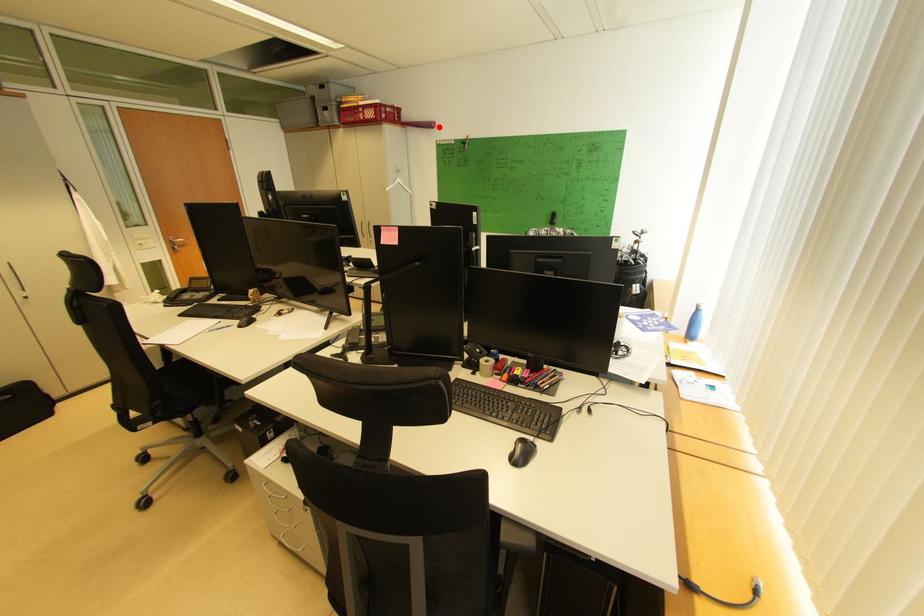
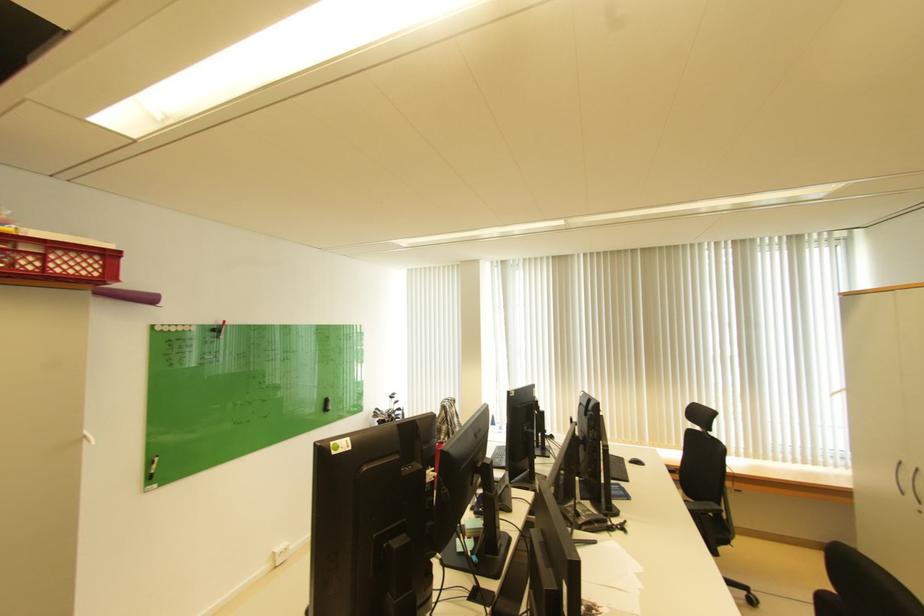
In the second image, find the point that corresponds to the highlighted location in the first image.

(160, 301)